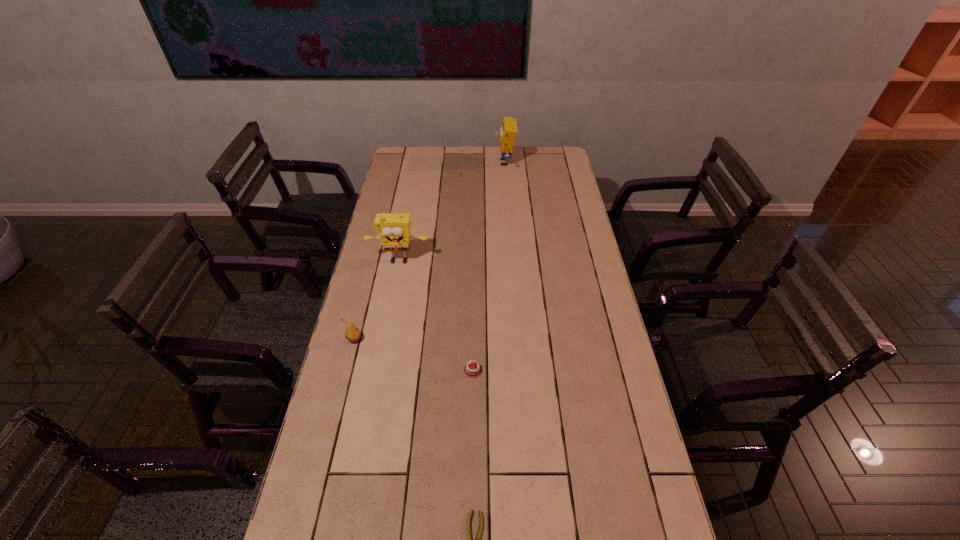
The image size is (960, 540). In order to click on vacant space at the far left corner of the desktop in this screenshot , I will do `click(409, 163)`.

Locate an element on the screen. This screenshot has height=540, width=960. vacant region at the far right corner of the desktop is located at coordinates coord(536,154).

I want to click on free spot between the fourth nearest object and the farthest object, so click(452, 212).

In order to click on empty location between the fourth tallest object and the third nearest object in this screenshot , I will do `click(414, 355)`.

Find the location of `vacant area that lies between the third nearest object and the fourth nearest object`. vacant area that lies between the third nearest object and the fourth nearest object is located at coordinates (376, 301).

What are the coordinates of `empty space between the second farthest object and the chocolate cake` in the screenshot? It's located at (436, 316).

Locate an element on the screen. free space between the left sponge and the pear is located at coordinates (376, 301).

At what (x,y) coordinates should I click in order to perform the action: click on unoccupied area between the fourth tallest object and the fourth nearest object. Please return your answer as a coordinate pair (x, y). Looking at the image, I should click on (436, 316).

Locate an element on the screen. This screenshot has height=540, width=960. the fourth closest object to the pliers is located at coordinates (508, 131).

Select which object is the second closest to the nearer sponge. Please provide its 2D coordinates. Your answer should be formatted as a tuple, i.e. [(x, y)], where the tuple contains the x and y coordinates of a point satisfying the conditions above.

[(472, 370)]